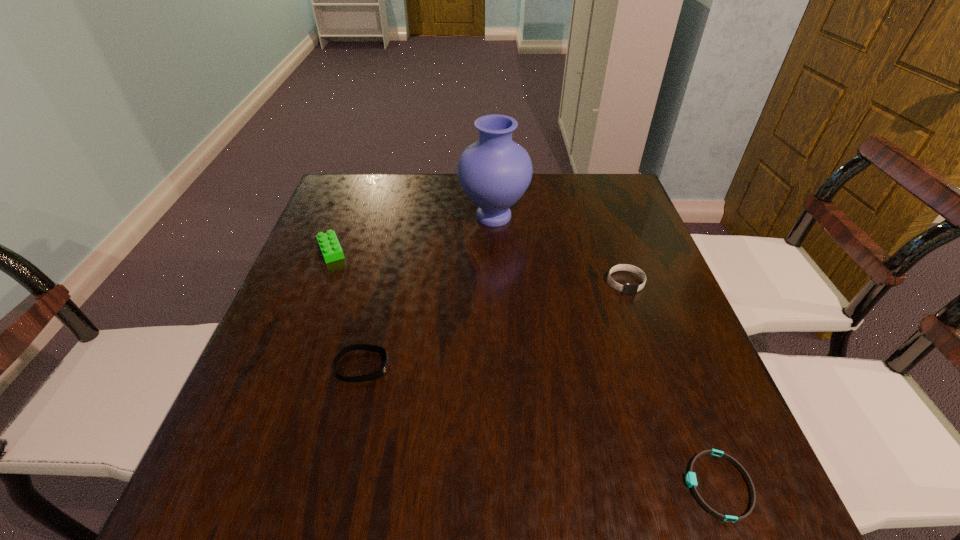
Find the location of a particular element. This screenshot has width=960, height=540. the third object from right to left is located at coordinates (494, 172).

Locate an element on the screen. This screenshot has height=540, width=960. vase is located at coordinates (494, 172).

Locate an element on the screen. the leftmost object is located at coordinates (330, 247).

This screenshot has height=540, width=960. Find the location of `the tallest wristband`. the tallest wristband is located at coordinates (628, 288).

Image resolution: width=960 pixels, height=540 pixels. Find the location of `the farthest wristband`. the farthest wristband is located at coordinates (628, 288).

Find the location of a particular element. The width and height of the screenshot is (960, 540). the fourth tallest object is located at coordinates (378, 374).

You are a GUI agent. You are given a task and a screenshot of the screen. Output one action in this format:
    pyautogui.click(x=<x>, y=<y>)
    Task: Click on the second nearest object
    The image size is (960, 540).
    Given the screenshot: What is the action you would take?
    pyautogui.click(x=378, y=374)

Where is `the shortest object`? The width and height of the screenshot is (960, 540). the shortest object is located at coordinates (691, 481).

In order to click on the shortest wristband in this screenshot , I will do `click(691, 481)`.

Locate an element on the screen. The height and width of the screenshot is (540, 960). blank space located 0.110m on the right of the vase is located at coordinates (566, 217).